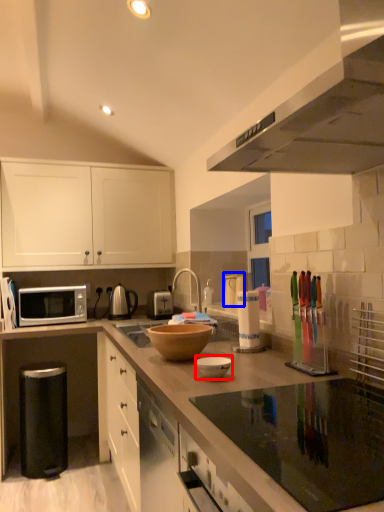
Question: Which of the following is the farthest to the observer, bowl (highlighted by a red box) or appliance (highlighted by a blue box)?

Choices:
 (A) bowl
 (B) appliance

Answer: (B)